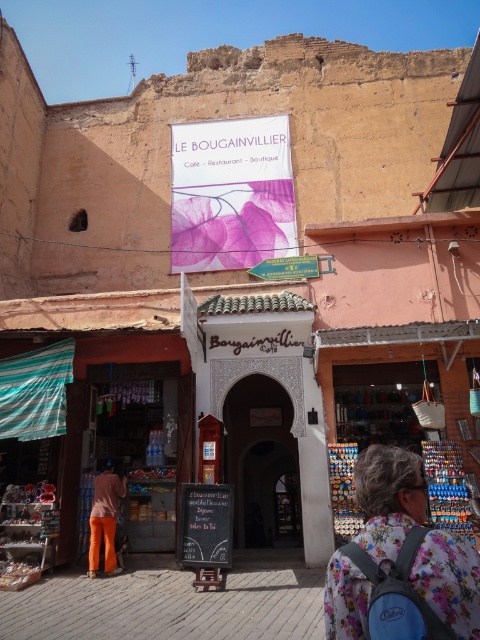
You are standing in front of the building with the sign Le Bougainvillier. There is a point at coordinate (328, 636) that you need to reach. Can you estimate how far you need to walk to get there?

The point at coordinate (328, 636) is 2.86 meters away from the camera, so you need to walk approximately 2.86 meters to reach it.

You are a tourist standing in front of the building with the two signs. You want to take a photo that includes both the pink paper sign at upper center and the black chalkboard sign at center. What is the minimum distance you need to step back to ensure both signs are in the frame?

The pink paper sign at upper center and black chalkboard sign at center are 7.80 meters apart. To capture both signs in the frame, you need to step back at least 7.80 meters.

You are a tourist in the market and want to read both the pink paper sign at upper center and the black chalkboard sign at center. Which sign do you need to look up higher to see?

The pink paper sign at upper center is located above the black chalkboard sign at center, so you need to look up higher to see the pink paper sign at upper center.